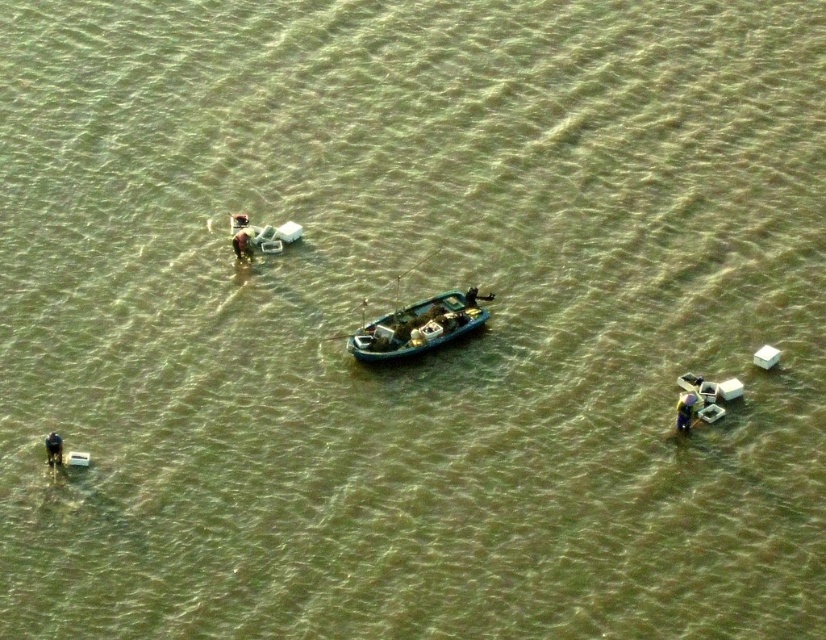
Question: Which point is closer to the camera taking this photo?

Choices:
 (A) (50, 444)
 (B) (381, 356)

Answer: (A)

Question: Is blue plastic boat at center bigger than dark blue fabric person at center?

Choices:
 (A) no
 (B) yes

Answer: (B)

Question: Which of the following is the farthest from the observer?

Choices:
 (A) blue plastic boat at center
 (B) brown leather jacket at upper center
 (C) green fabric person at lower right
 (D) dark blue fabric person at center

Answer: (B)

Question: Estimate the real-world distances between objects in this image. Which object is closer to the brown leather jacket at upper center?

Choices:
 (A) green fabric person at lower right
 (B) dark blue fabric person at lower left
 (C) blue plastic boat at center
 (D) dark blue fabric person at center

Answer: (C)

Question: Where is green fabric person at lower right located in relation to brown leather jacket at upper center in the image?

Choices:
 (A) right
 (B) left

Answer: (A)

Question: Is green fabric person at lower right to the left of dark blue fabric person at lower left from the viewer's perspective?

Choices:
 (A) no
 (B) yes

Answer: (A)